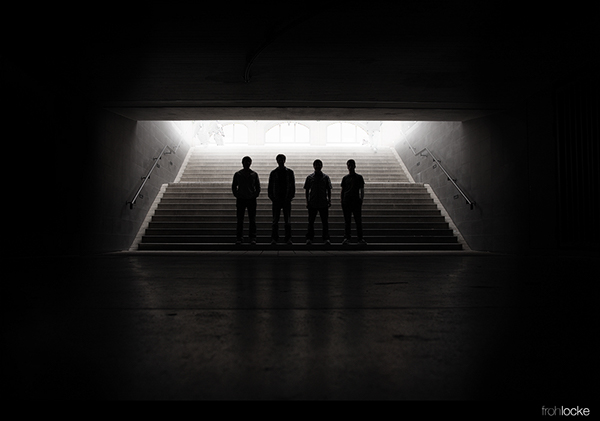
At what (x,y) coordinates should I click in order to perform the action: click on floor. Please return your answer as a coordinate pair (x, y). Image resolution: width=600 pixels, height=421 pixels. Looking at the image, I should click on (315, 317).